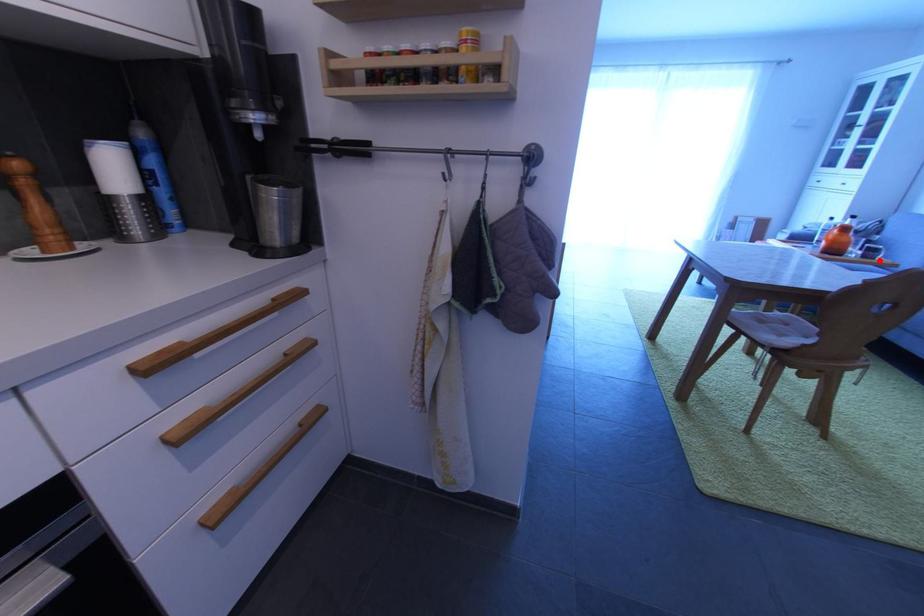
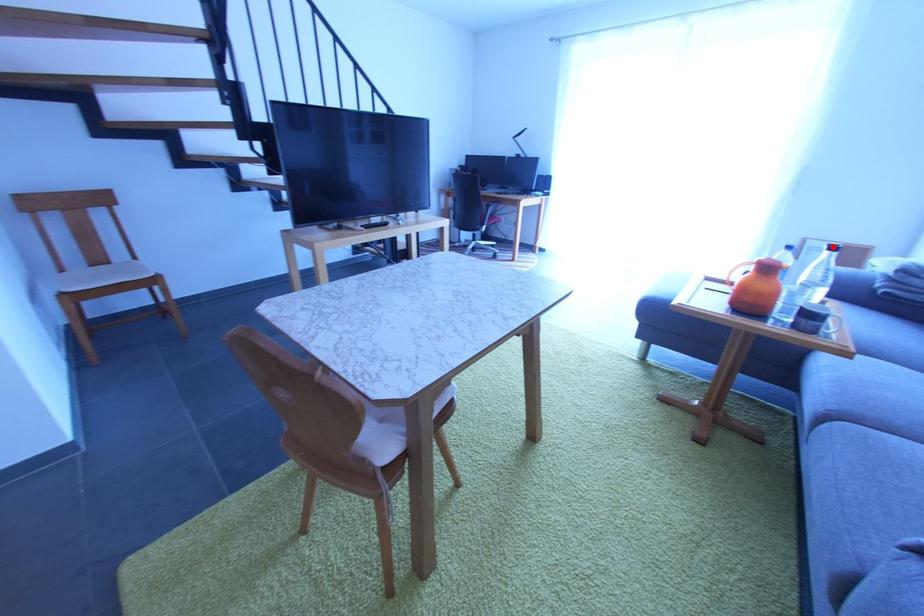
I am providing you with two images of the same scene from different viewpoints. A red point is marked on the first image and another point is marked on the second image. Do the highlighted points in image1 and image2 indicate the same real-world spot?

No